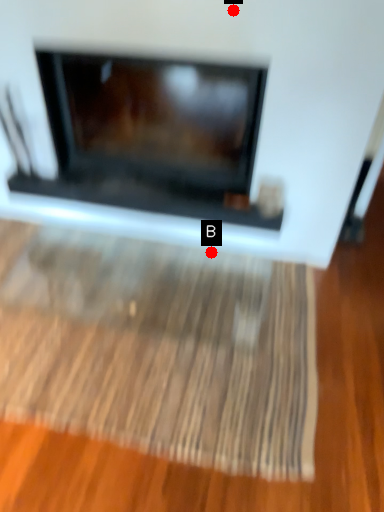
Question: Two points are circled on the image, labeled by A and B beside each circle. Which point is closer to the camera taking this photo?

Choices:
 (A) A is closer
 (B) B is closer

Answer: (A)